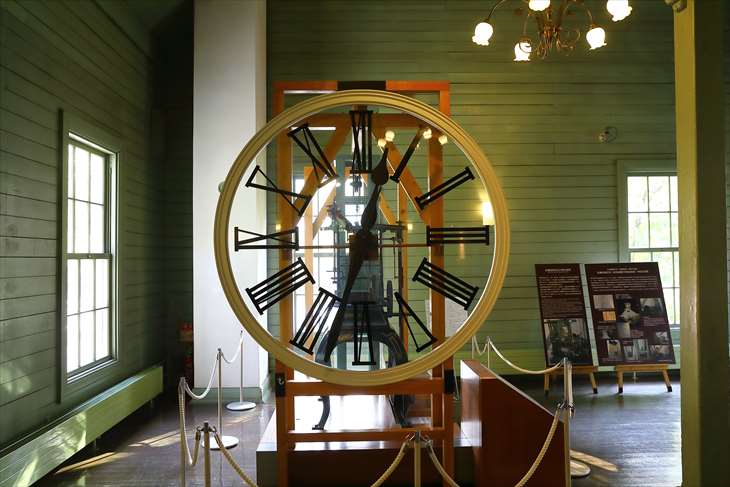
This screenshot has height=487, width=730. In order to click on chandelier in this screenshot , I will do `click(556, 26)`.